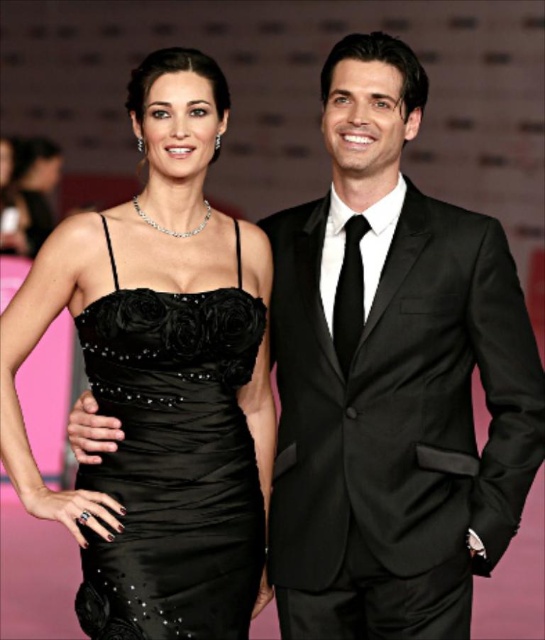
Question: Is shiny black suit at right to the right of black satin dress at center from the viewer's perspective?

Choices:
 (A) no
 (B) yes

Answer: (B)

Question: Among these points, which one is nearest to the camera?

Choices:
 (A) (422, 529)
 (B) (158, 573)

Answer: (B)

Question: Is shiny black suit at right thinner than black satin dress at center?

Choices:
 (A) yes
 (B) no

Answer: (B)

Question: Is shiny black suit at right bigger than black satin dress at center?

Choices:
 (A) no
 (B) yes

Answer: (B)

Question: Which point appears closest to the camera in this image?

Choices:
 (A) (239, 618)
 (B) (379, 186)

Answer: (A)

Question: Which of the following is the farthest from the observer?

Choices:
 (A) (252, 595)
 (B) (370, 72)

Answer: (A)